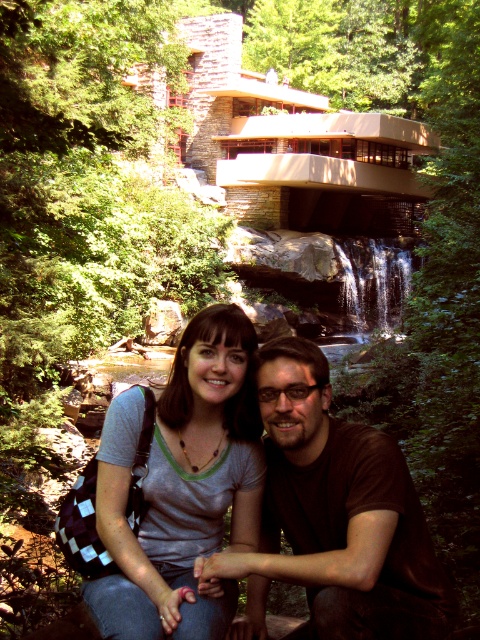
Between brown matte shirt at center and matte gray t-shirt at center, which one appears on the left side from the viewer's perspective?

matte gray t-shirt at center is more to the left.

Identify the location of brown matte shirt at center. This screenshot has width=480, height=640. (335, 516).